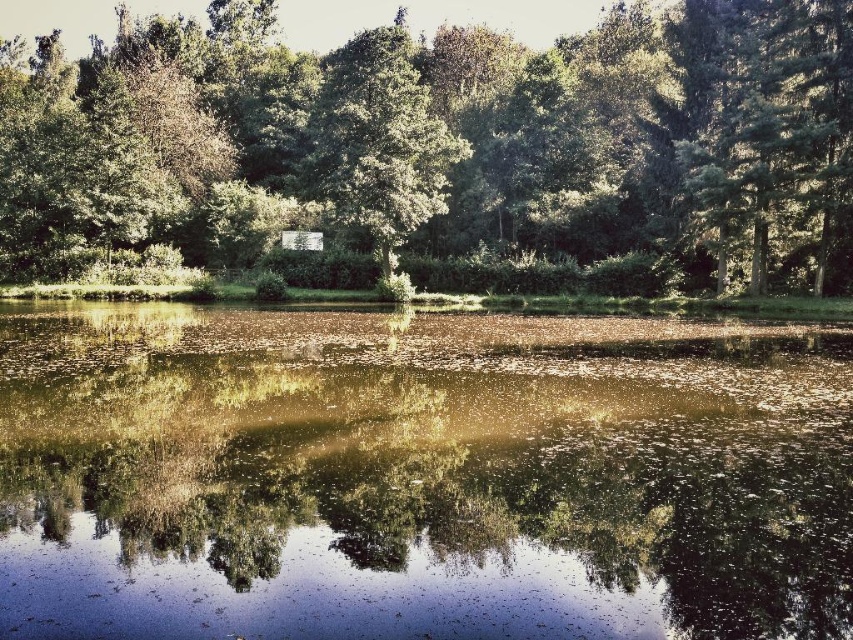
You are standing at the center of the image and want to locate the green textured tree at upper right. In which cardinal direction should you look to find it?

The green textured tree at upper right is located at point coordinates that indicate it is in the upper right direction from your position at the center. Therefore, you should look towards the northeast direction to find it.

You are a bird flying over the serene natural scene. You want to land on a tree branch. Which tree should you choose between the green leafy tree at upper center and the green textured tree at upper right if you want to land closer to the water?

The green leafy tree at upper center is closer to the water than the green textured tree at upper right because the distance between them is 14.36 meters, so landing on the green leafy tree at upper center would place you nearer to the water.

Looking at this image, you are an ornithologist observing two trees in a serene natural scene. You see the green textured tree at upper right and the green leafy tree at center. Which tree would you estimate to have a smaller height?

The green textured tree at upper right has a smaller size compared to the green leafy tree at center, so it is the smaller one.